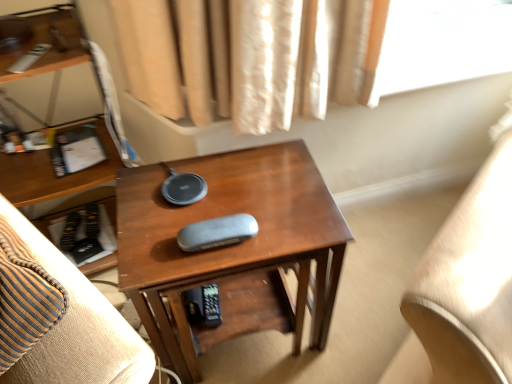
Question: From the image's perspective, would you say wooden side table at center is shown under shiny brown desk at center?

Choices:
 (A) yes
 (B) no

Answer: (B)

Question: Is wooden side table at center next to shiny brown desk at center and touching it?

Choices:
 (A) yes
 (B) no

Answer: (B)

Question: From a real-world perspective, is wooden side table at center positioned over shiny brown desk at center based on gravity?

Choices:
 (A) yes
 (B) no

Answer: (A)

Question: Would you say wooden side table at center is a long distance from shiny brown desk at center?

Choices:
 (A) no
 (B) yes

Answer: (A)

Question: Can you confirm if wooden side table at center is smaller than shiny brown desk at center?

Choices:
 (A) no
 (B) yes

Answer: (B)

Question: From a real-world perspective, is wooden side table at center physically below shiny brown desk at center?

Choices:
 (A) yes
 (B) no

Answer: (B)

Question: Is shiny brown desk at center wider than wooden side table at center?

Choices:
 (A) yes
 (B) no

Answer: (B)

Question: Considering the relative sizes of shiny brown desk at center and wooden side table at center in the image provided, is shiny brown desk at center shorter than wooden side table at center?

Choices:
 (A) yes
 (B) no

Answer: (B)

Question: Is shiny brown desk at center next to wooden side table at center and touching it?

Choices:
 (A) yes
 (B) no

Answer: (B)

Question: From the image's perspective, would you say shiny brown desk at center is positioned over wooden side table at center?

Choices:
 (A) no
 (B) yes

Answer: (A)

Question: Does shiny brown desk at center appear on the right side of wooden side table at center?

Choices:
 (A) no
 (B) yes

Answer: (B)

Question: From a real-world perspective, is shiny brown desk at center physically above wooden side table at center?

Choices:
 (A) no
 (B) yes

Answer: (A)

Question: Is point (7, 208) positioned closer to the camera than point (246, 195)?

Choices:
 (A) closer
 (B) farther

Answer: (A)